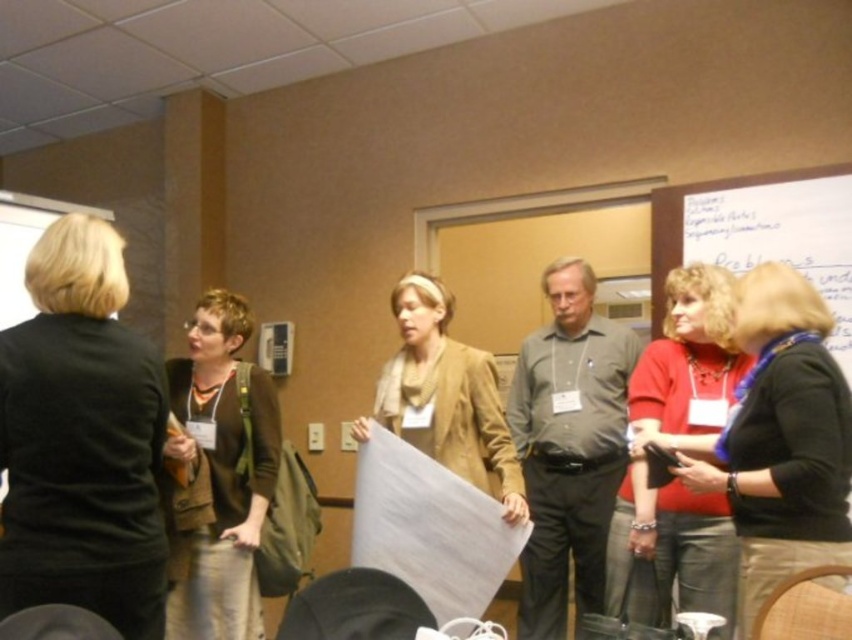
Question: Estimate the real-world distances between objects in this image. Which object is farther from the matte red shirt at center?

Choices:
 (A) brown fabric vest at center-left
 (B) matte black shirt at center
 (C) suede tan jacket at center

Answer: (A)

Question: Is gray matte shirt at center thinner than brown fabric vest at center-left?

Choices:
 (A) no
 (B) yes

Answer: (A)

Question: Which of the following is the farthest from the observer?

Choices:
 (A) (269, 413)
 (B) (418, 432)

Answer: (A)

Question: Can you confirm if gray matte shirt at center is positioned below brown fabric vest at center-left?

Choices:
 (A) yes
 (B) no

Answer: (A)

Question: Which of the following is the closest to the observer?

Choices:
 (A) brown fabric vest at center-left
 (B) suede tan jacket at center

Answer: (B)

Question: Does matte black shirt at center have a greater width compared to suede tan jacket at center?

Choices:
 (A) no
 (B) yes

Answer: (A)